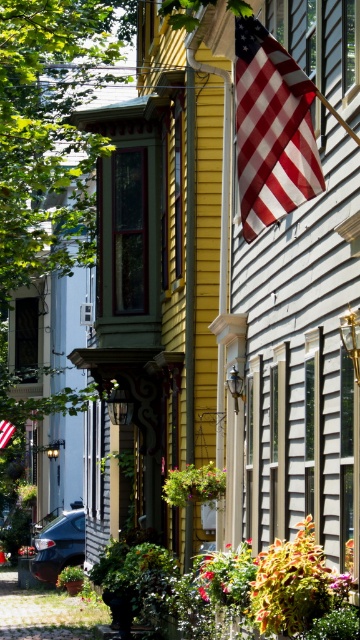
You are a photographer trying to capture both the american flag at upper right and the american flag at upper center in a single frame. Which flag would you need to adjust your camera angle to include more of its details due to its size?

The american flag at upper right has a larger width than the american flag at upper center, so you would need to adjust your camera angle to include more details of the american flag at upper right because it is wider.